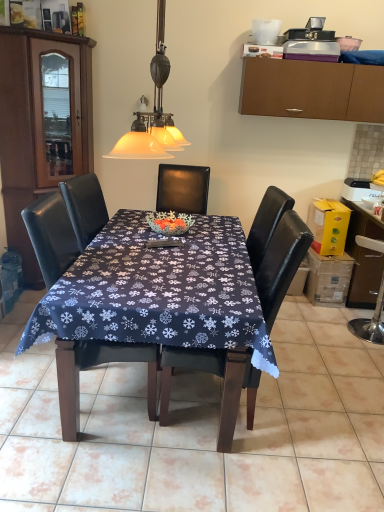
Measure the distance between point (377, 343) and camera.

They are 3.04 meters apart.

The width and height of the screenshot is (384, 512). What do you see at coordinates (51, 236) in the screenshot?
I see `black leather chair at center, arranged as the 1th chair when viewed from the left` at bounding box center [51, 236].

The width and height of the screenshot is (384, 512). What do you see at coordinates (153, 112) in the screenshot?
I see `translucent glass pendant light at upper center` at bounding box center [153, 112].

How much space does brown matte cabinet at upper right, which is the 1th cabinetry from right to left, occupy horizontally?

It is 4.00 feet.

Measure the distance between dark blue fabric at center and camera.

The depth of dark blue fabric at center is 1.69 meters.

What do you see at coordinates (200, 428) in the screenshot? The width and height of the screenshot is (384, 512). I see `dark blue fabric at center` at bounding box center [200, 428].

Measure the distance between dark blue fabric tablecloth at center and camera.

dark blue fabric tablecloth at center is 5.59 feet away from camera.

The height and width of the screenshot is (512, 384). I want to click on metallic silver swivel chair at right, so click(x=371, y=321).

From the image's perspective, count 2nd chairs downward from the metallic silver swivel chair at right and point to it. Please provide its 2D coordinates.

[(276, 255)]

How different are the orientations of black leather chair at center, acting as the second chair starting from the left, and metallic silver swivel chair at right in degrees?

They differ by 141 degrees in their facing directions.

Does point (162, 389) come in front of point (382, 310)?

That is True.

Is black leather chair at center, acting as the second chair starting from the left, far away from metallic silver swivel chair at right?

Indeed, black leather chair at center, acting as the second chair starting from the left, is not near metallic silver swivel chair at right.

Can you confirm if black leather chair at center, the 2th chair in the right-to-left sequence, is wider than dark blue fabric at center?

In fact, black leather chair at center, the 2th chair in the right-to-left sequence, might be narrower than dark blue fabric at center.

At what (x,y) coordinates should I click in order to perform the action: click on the 2nd chair positioned above the dark blue fabric at center (from the image's perspective). Please return your answer as a coordinate pair (x, y). The image size is (384, 512). Looking at the image, I should click on (51, 236).

Is black leather chair at center, arranged as the 1th chair when viewed from the left, placed right next to dark blue fabric at center?

black leather chair at center, arranged as the 1th chair when viewed from the left, is not next to dark blue fabric at center, and they're not touching.

Can we say black leather chair at center, arranged as the 1th chair when viewed from the left, lies outside dark blue fabric at center?

Yes, black leather chair at center, arranged as the 1th chair when viewed from the left, is located beyond the bounds of dark blue fabric at center.

Between black leather chair at center, arranged as the 1th chair when viewed from the left, and metallic silver swivel chair at right, which one appears on the right side from the viewer's perspective?

metallic silver swivel chair at right.

Could you measure the distance between black leather chair at center, the 2th chair in the right-to-left sequence, and metallic silver swivel chair at right?

5.93 feet.

What are the coordinates of `swivel chair to the right of black leather chair at center, the 2th chair in the right-to-left sequence` in the screenshot? It's located at (371, 321).

Find the location of a particular element. The width and height of the screenshot is (384, 512). chair lying on the left of black leather chair at center, acting as the second chair starting from the left is located at coordinates (51, 236).

Does black leather chair at center, which is the 1th chair from right to left, lie behind black leather chair at center, the 2th chair in the right-to-left sequence?

No, the depth of black leather chair at center, which is the 1th chair from right to left, is less than that of black leather chair at center, the 2th chair in the right-to-left sequence.

In terms of height, does black leather chair at center, acting as the second chair starting from the left, look taller or shorter compared to black leather chair at center, arranged as the 1th chair when viewed from the left?

In the image, black leather chair at center, acting as the second chair starting from the left, appears to be shorter than black leather chair at center, arranged as the 1th chair when viewed from the left.

Relative to brown matte cabinet at upper right, which is the 1th cabinetry from right to left, is brown wood cabinet at left, positioned as the 2th cabinetry in right-to-left order, in front or behind?

Visually, brown wood cabinet at left, positioned as the 2th cabinetry in right-to-left order, is located in front of brown matte cabinet at upper right, which is the 1th cabinetry from right to left.

Which of these two, brown wood cabinet at left, positioned as the 2th cabinetry in right-to-left order, or brown matte cabinet at upper right, which is the 1th cabinetry from right to left, stands shorter?

With less height is brown matte cabinet at upper right, which is the 1th cabinetry from right to left.

Consider the image. From the image's perspective, which object appears higher, brown wood cabinet at left, which ranks as the first cabinetry in left-to-right order, or brown matte cabinet at upper right, the 2th cabinetry from the left?

From the image's view, brown matte cabinet at upper right, the 2th cabinetry from the left, is above.

Is brown wood cabinet at left, which ranks as the first cabinetry in left-to-right order, to the left of brown matte cabinet at upper right, the 2th cabinetry from the left, from the viewer's perspective?

Indeed, brown wood cabinet at left, which ranks as the first cabinetry in left-to-right order, is positioned on the left side of brown matte cabinet at upper right, the 2th cabinetry from the left.

How many degrees apart are the facing directions of translucent glass pendant light at upper center and dark blue fabric at center?

They differ by 88.6 degrees in their facing directions.

Are translucent glass pendant light at upper center and dark blue fabric at center far apart?

Yes, translucent glass pendant light at upper center is far from dark blue fabric at center.

Who is taller, translucent glass pendant light at upper center or dark blue fabric at center?

translucent glass pendant light at upper center is taller.

The width and height of the screenshot is (384, 512). Identify the location of tile below the translucent glass pendant light at upper center (from a real-world perspective). (200, 428).

Between dark blue fabric tablecloth at center and translucent glass pendant light at upper center, which one has larger width?

Wider between the two is dark blue fabric tablecloth at center.

This screenshot has width=384, height=512. Find the location of `desk below the translucent glass pendant light at upper center (from the image's perspective)`. desk below the translucent glass pendant light at upper center (from the image's perspective) is located at coordinates (155, 306).

Does point (193, 231) appear closer or farther from the camera than point (156, 126)?

Point (193, 231).

Is dark blue fabric tablecloth at center inside or outside of translucent glass pendant light at upper center?

dark blue fabric tablecloth at center is located beyond the bounds of translucent glass pendant light at upper center.

Locate an element on the screen. This screenshot has height=512, width=384. the 2nd chair in front of the metallic silver swivel chair at right is located at coordinates (276, 255).

Locate an element on the screen. This screenshot has height=512, width=384. the 2nd chair directly above the dark blue fabric at center (from a real-world perspective) is located at coordinates (51, 236).

Looking at the image, which one is located further to brown matte cabinet at upper right, the 2th cabinetry from the left, dark blue fabric at center or black leather chair at center, arranged as the 1th chair when viewed from the left?

black leather chair at center, arranged as the 1th chair when viewed from the left.

Which object lies further to the anchor point translucent glass pendant light at upper center, brown wood cabinet at left, positioned as the 2th cabinetry in right-to-left order, or brown matte cabinet at upper right, which is the 1th cabinetry from right to left?

brown matte cabinet at upper right, which is the 1th cabinetry from right to left, is further to translucent glass pendant light at upper center.

From the image, which object appears to be nearer to metallic silver swivel chair at right, black leather chair at center, arranged as the 1th chair when viewed from the left, or brown matte cabinet at upper right, which is the 1th cabinetry from right to left?

brown matte cabinet at upper right, which is the 1th cabinetry from right to left.

When comparing their distances from metallic silver swivel chair at right, does brown matte cabinet at upper right, the 2th cabinetry from the left, or black leather chair at center, arranged as the 1th chair when viewed from the left, seem closer?

The object closer to metallic silver swivel chair at right is brown matte cabinet at upper right, the 2th cabinetry from the left.

Which object lies nearer to the anchor point metallic silver swivel chair at right, brown wood cabinet at left, which ranks as the first cabinetry in left-to-right order, or black leather chair at center, the 2th chair in the right-to-left sequence?

black leather chair at center, the 2th chair in the right-to-left sequence, is closer to metallic silver swivel chair at right.

Which object lies nearer to the anchor point dark blue fabric tablecloth at center, brown wood cabinet at left, positioned as the 2th cabinetry in right-to-left order, or metallic silver swivel chair at right?

Among the two, brown wood cabinet at left, positioned as the 2th cabinetry in right-to-left order, is located nearer to dark blue fabric tablecloth at center.

Looking at the image, which one is located further to translucent glass pendant light at upper center, black leather chair at center, arranged as the 1th chair when viewed from the left, or dark blue fabric at center?

dark blue fabric at center lies further to translucent glass pendant light at upper center than the other object.

Considering their positions, is dark blue fabric tablecloth at center positioned closer to metallic silver swivel chair at right than brown matte cabinet at upper right, the 2th cabinetry from the left?

Among the two, brown matte cabinet at upper right, the 2th cabinetry from the left, is located nearer to metallic silver swivel chair at right.

The width and height of the screenshot is (384, 512). I want to click on tile between brown wood cabinet at left, which ranks as the first cabinetry in left-to-right order, and metallic silver swivel chair at right, so click(x=200, y=428).

I want to click on chair between brown matte cabinet at upper right, which is the 1th cabinetry from right to left, and black leather chair at center, acting as the second chair starting from the left, vertically, so click(51, 236).

You are a GUI agent. You are given a task and a screenshot of the screen. Output one action in this format:
    pyautogui.click(x=<x>, y=<y>)
    Task: Click on the desk between brown wood cabinet at left, which ranks as the first cabinetry in left-to-right order, and dark blue fabric at center in the up-down direction
    Image resolution: width=384 pixels, height=512 pixels.
    Given the screenshot: What is the action you would take?
    pyautogui.click(x=155, y=306)

What are the coordinates of `chair between translucent glass pendant light at upper center and metallic silver swivel chair at right from left to right` in the screenshot? It's located at (276, 255).